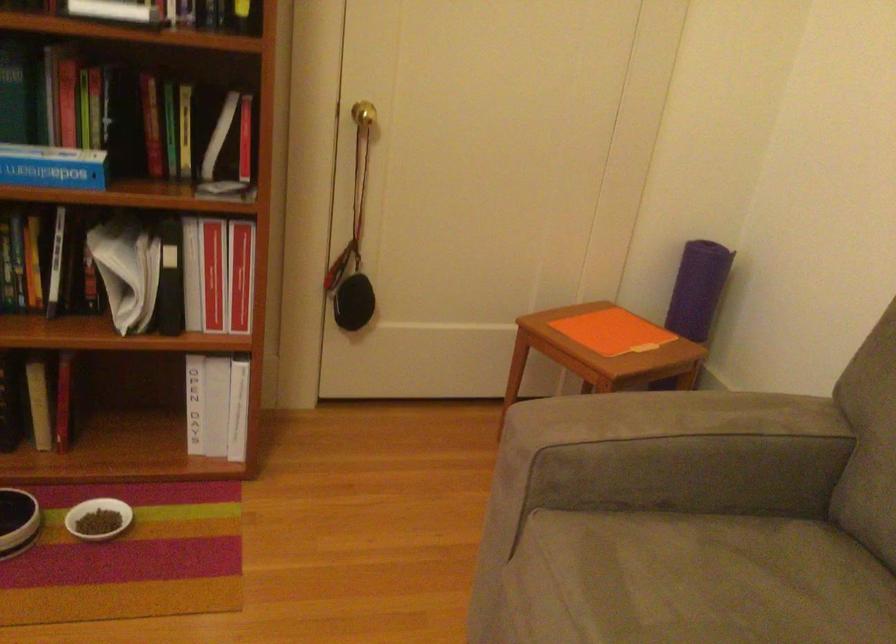
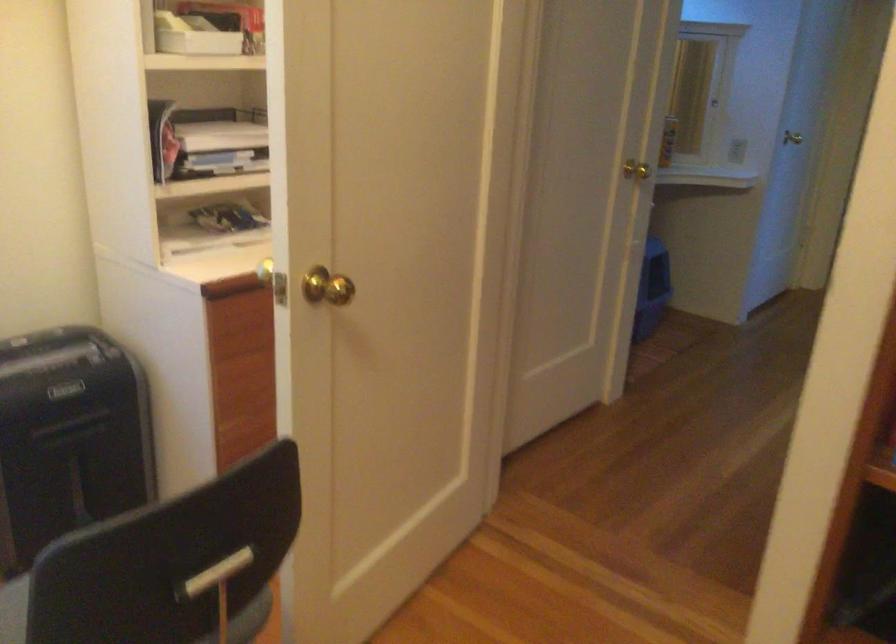
Question: How did the camera likely rotate?

Choices:
 (A) Left
 (B) Right
 (C) Up
 (D) Down

Answer: (A)